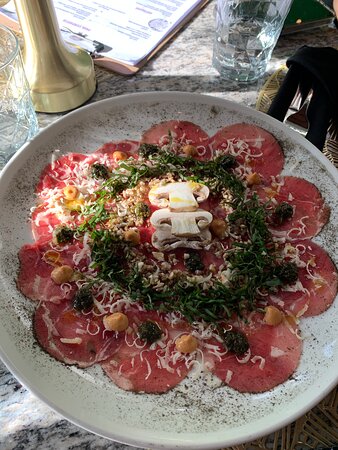
You are a GUI agent. You are given a task and a screenshot of the screen. Output one action in this format:
    pyautogui.click(x=<x>, y=<y>)
    Task: Click on the glass
    This screenshot has height=450, width=338.
    Given the screenshot: What is the action you would take?
    click(253, 50), click(3, 113)